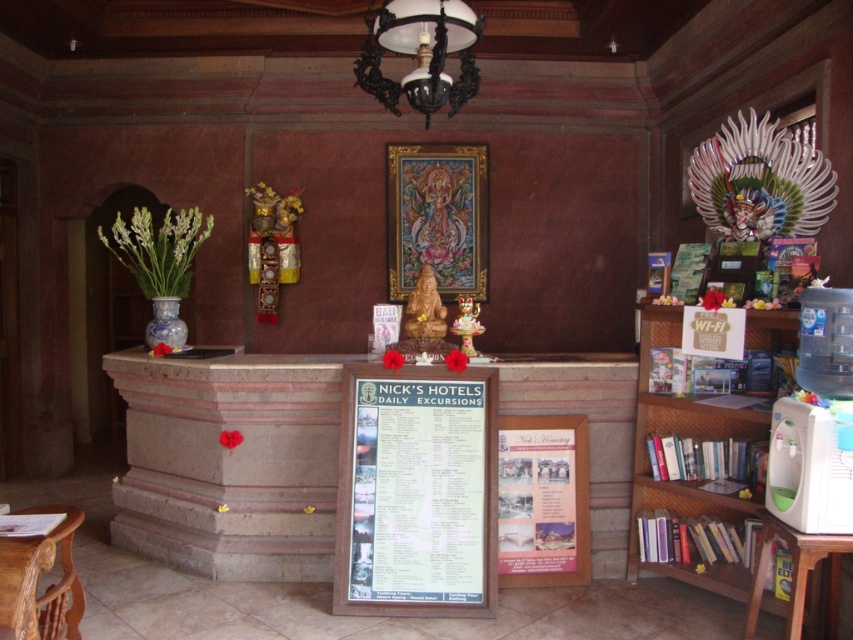
Question: Estimate the real-world distances between objects in this image. Which object is farther from the wooden table at lower right?

Choices:
 (A) white paper poster at center
 (B) wooden table at lower left

Answer: (B)

Question: Can you confirm if wooden bookshelf at right is positioned below wooden table at lower right?

Choices:
 (A) no
 (B) yes

Answer: (A)

Question: Does white paper poster at center appear on the left side of wooden table at lower left?

Choices:
 (A) no
 (B) yes

Answer: (A)

Question: Which point appears closest to the camera in this image?

Choices:
 (A) (397, 460)
 (B) (7, 572)
 (C) (421, 80)
 (D) (757, 417)

Answer: (B)

Question: Can you confirm if wooden bookshelf at right is positioned above white matte lampshade at upper center?

Choices:
 (A) yes
 (B) no

Answer: (B)

Question: Estimate the real-world distances between objects in this image. Which object is farther from the wooden table at lower right?

Choices:
 (A) wooden table at lower left
 (B) white paper poster at center

Answer: (A)